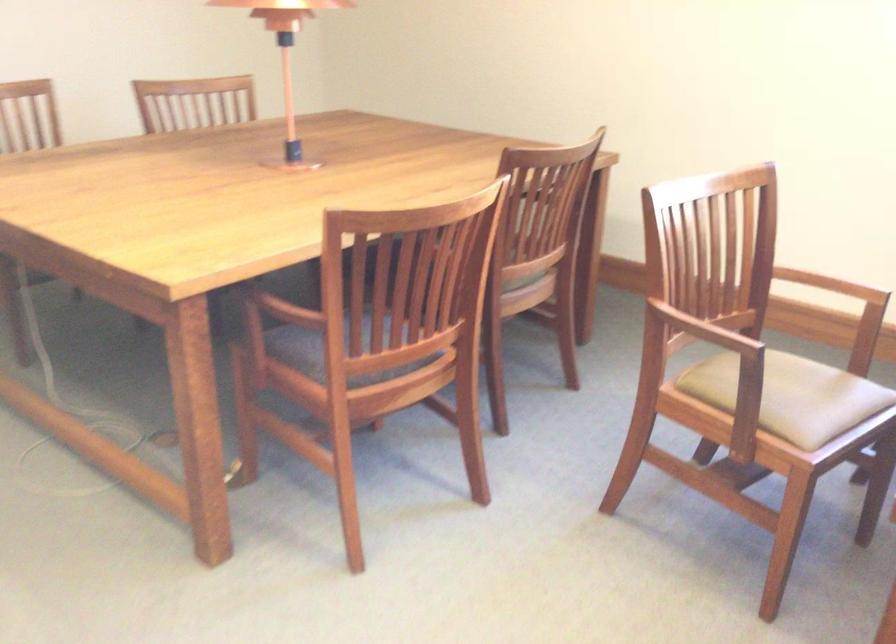
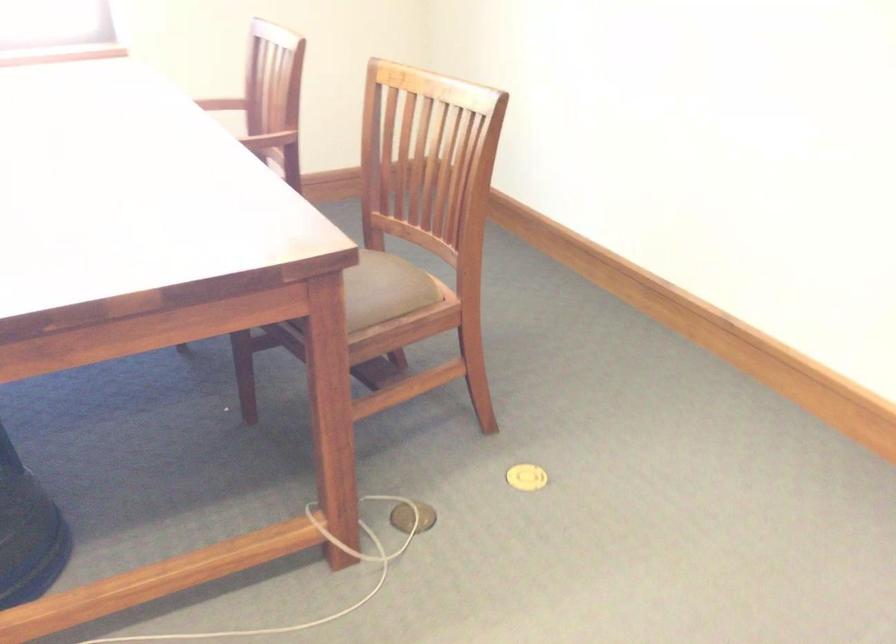
Based on the continuous images, in which direction is the camera rotating?

The rotation direction of the camera is right-down.